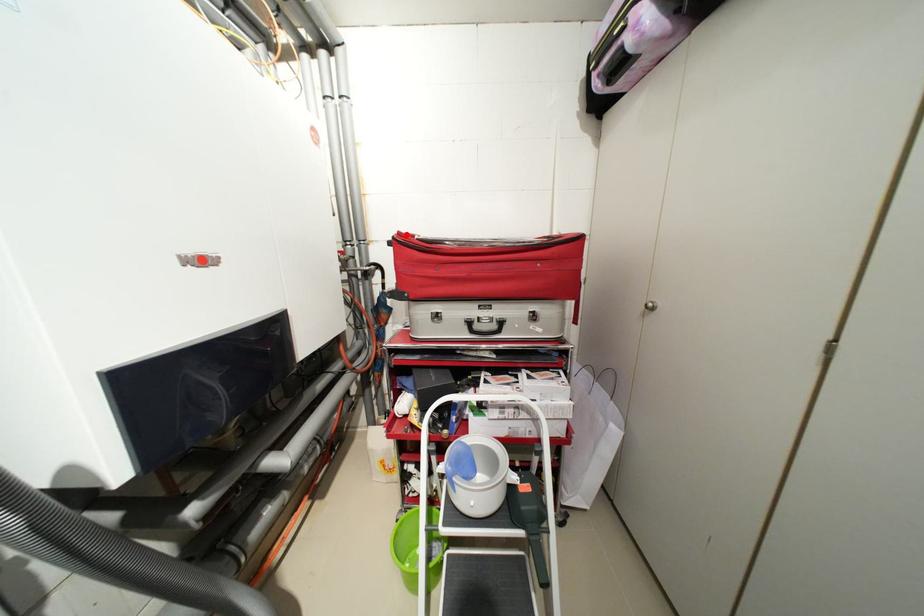
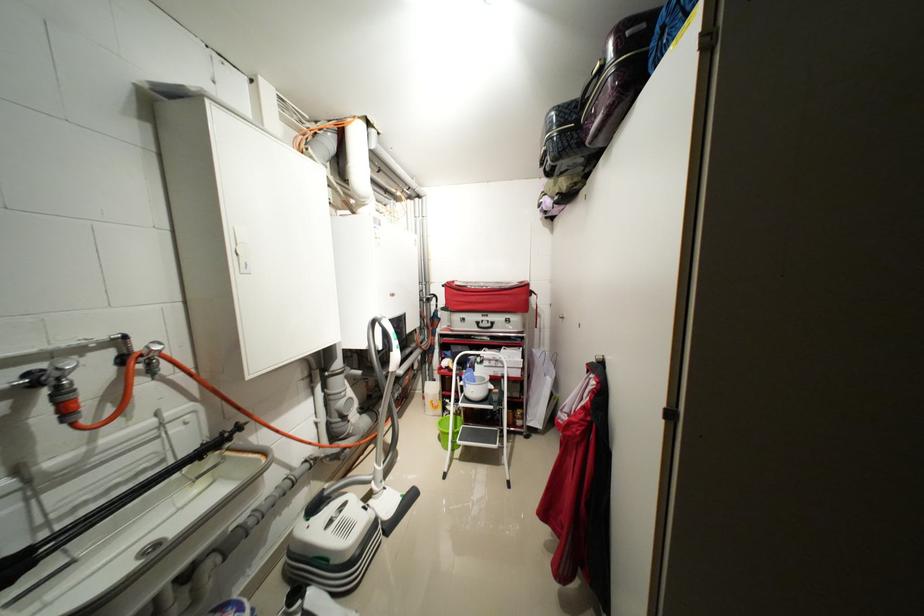
Where in the second image is the point corresponding to the highlighted location from the first image?

(455, 284)